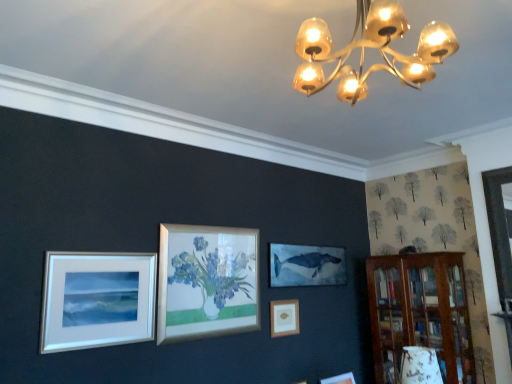
You are a GUI agent. You are given a task and a screenshot of the screen. Output one action in this format:
    pyautogui.click(x=<x>, y=<y>)
    Task: Click on the wooden frame at center, the 1th picture frame when ordered from right to left
    
    Given the screenshot: What is the action you would take?
    pyautogui.click(x=284, y=318)

Identify the location of wooden bookshelf at right. This screenshot has width=512, height=384. (420, 313).

The image size is (512, 384). Identify the location of wooden frame at center, the 2th picture frame viewed from the front. (284, 318).

Between metallic gold chandelier at upper center and wooden frame at center, the 2th picture frame viewed from the left, which one has larger size?

metallic gold chandelier at upper center is bigger.

Based on the photo, which object is wider, metallic gold chandelier at upper center or wooden frame at center, the 1th picture frame from the bottom?

Wider between the two is metallic gold chandelier at upper center.

From the image's perspective, is metallic gold chandelier at upper center on top of wooden frame at center, the 1th picture frame from the bottom?

Yes.

Is metallic gold chandelier at upper center aimed at wooden frame at center, the 1th picture frame when ordered from right to left?

No, metallic gold chandelier at upper center does not turn towards wooden frame at center, the 1th picture frame when ordered from right to left.

Is point (147, 272) closer or farther from the camera than point (361, 51)?

Point (147, 272) appears to be farther away from the viewer than point (361, 51).

Identify the location of lamp on the right of white matte picture frame at lower left, which is the 2th picture frame from back to front. (370, 47).

Would you say white matte picture frame at lower left, which ranks as the 1th picture frame in front-to-back order, contains metallic gold chandelier at upper center?

That's incorrect, metallic gold chandelier at upper center is not inside white matte picture frame at lower left, which ranks as the 1th picture frame in front-to-back order.

Is there a large distance between white matte picture frame at lower left, the first picture frame from the left, and metallic gold chandelier at upper center?

Yes, white matte picture frame at lower left, the first picture frame from the left, and metallic gold chandelier at upper center are quite far apart.

Considering the relative sizes of metallic gold chandelier at upper center and wooden bookshelf at right in the image provided, is metallic gold chandelier at upper center shorter than wooden bookshelf at right?

Yes.

Considering the positions of objects metallic gold chandelier at upper center and wooden bookshelf at right in the image provided, who is more to the right, metallic gold chandelier at upper center or wooden bookshelf at right?

Positioned to the right is wooden bookshelf at right.

From the picture: From the image's perspective, who appears lower, metallic gold chandelier at upper center or wooden bookshelf at right?

wooden bookshelf at right is shown below in the image.

In the scene shown: Is metallic gold chandelier at upper center bigger than wooden bookshelf at right?

No, metallic gold chandelier at upper center is not bigger than wooden bookshelf at right.

Where is `picture frame that appears in front of the wooden frame at center, the 1th picture frame when ordered from right to left`? Image resolution: width=512 pixels, height=384 pixels. picture frame that appears in front of the wooden frame at center, the 1th picture frame when ordered from right to left is located at coordinates (97, 300).

From the image's perspective, which one is positioned higher, wooden frame at center, the 1th picture frame from the bottom, or white matte picture frame at lower left, the first picture frame from the left?

white matte picture frame at lower left, the first picture frame from the left, is shown above in the image.

Based on the photo, between wooden frame at center, the 1th picture frame from the bottom, and white matte picture frame at lower left, which is the 2th picture frame from back to front, which one has less height?

Standing shorter between the two is wooden frame at center, the 1th picture frame from the bottom.

Considering the sizes of wooden bookshelf at right and metallic gold chandelier at upper center in the image, is wooden bookshelf at right taller or shorter than metallic gold chandelier at upper center?

Clearly, wooden bookshelf at right is taller compared to metallic gold chandelier at upper center.

From the picture: Do you think wooden bookshelf at right is within metallic gold chandelier at upper center, or outside of it?

wooden bookshelf at right exists outside the volume of metallic gold chandelier at upper center.

From a real-world perspective, between wooden bookshelf at right and metallic gold chandelier at upper center, who is vertically lower?

From a 3D spatial view, wooden bookshelf at right is below.

Which is correct: wooden bookshelf at right is inside wooden frame at center, the 2th picture frame viewed from the front, or outside of it?

wooden bookshelf at right is spatially situated outside wooden frame at center, the 2th picture frame viewed from the front.

Is wooden bookshelf at right looking in the opposite direction of wooden frame at center, the 2th picture frame viewed from the left?

That's not correct — wooden bookshelf at right is not looking away from wooden frame at center, the 2th picture frame viewed from the left.

Does point (369, 299) come farther from viewer compared to point (296, 328)?

Yes.

Identify the location of bookshelf in front of the wooden frame at center, the 2th picture frame viewed from the left. (420, 313).

Would you consider metallic gold chandelier at upper center to be distant from white matte picture frame at lower left, which is the 1th picture frame from top to bottom?

Indeed, metallic gold chandelier at upper center is not near white matte picture frame at lower left, which is the 1th picture frame from top to bottom.

Between metallic gold chandelier at upper center and white matte picture frame at lower left, which is the second picture frame from bottom to top, which one has smaller size?

white matte picture frame at lower left, which is the second picture frame from bottom to top, is smaller.

In terms of height, does metallic gold chandelier at upper center look taller or shorter compared to white matte picture frame at lower left, which is the 2th picture frame from back to front?

In the image, metallic gold chandelier at upper center appears to be shorter than white matte picture frame at lower left, which is the 2th picture frame from back to front.

This screenshot has width=512, height=384. In order to click on lamp lying above the wooden frame at center, the first picture frame viewed from the back (from the image's perspective) in this screenshot , I will do `click(370, 47)`.

From the image's perspective, which picture frame is the 1st one below the metallic gold chandelier at upper center? Please provide its 2D coordinates.

[(97, 300)]

From the image, which object appears to be farther from white matte picture frame at lower left, the first picture frame from the left, wooden bookshelf at right or wooden frame at center, which appears as the second picture frame when viewed from the top?

The object further to white matte picture frame at lower left, the first picture frame from the left, is wooden bookshelf at right.

Based on their spatial positions, is wooden bookshelf at right or white matte picture frame at lower left, which is the second picture frame from bottom to top, further from metallic gold chandelier at upper center?

wooden bookshelf at right is further to metallic gold chandelier at upper center.

When comparing their distances from white matte picture frame at lower left, the 2th picture frame from the right, does metallic gold chandelier at upper center or wooden frame at center, the 2th picture frame viewed from the front, seem closer?

Based on the image, wooden frame at center, the 2th picture frame viewed from the front, appears to be nearer to white matte picture frame at lower left, the 2th picture frame from the right.

Estimate the real-world distances between objects in this image. Which object is further from metallic gold chandelier at upper center, wooden bookshelf at right or wooden frame at center, the 1th picture frame when ordered from right to left?

The object further to metallic gold chandelier at upper center is wooden bookshelf at right.

Looking at the image, which one is located further to metallic gold chandelier at upper center, wooden frame at center, the 1th picture frame from the bottom, or white matte picture frame at lower left, which is the second picture frame from bottom to top?

wooden frame at center, the 1th picture frame from the bottom.

When comparing their distances from wooden bookshelf at right, does white matte picture frame at lower left, which ranks as the 1th picture frame in front-to-back order, or wooden frame at center, the 1th picture frame from the bottom, seem further?

white matte picture frame at lower left, which ranks as the 1th picture frame in front-to-back order.

From the picture: Considering their positions, is wooden frame at center, the 2th picture frame viewed from the front, positioned closer to white matte picture frame at lower left, the first picture frame from the left, than wooden bookshelf at right?

The object closer to white matte picture frame at lower left, the first picture frame from the left, is wooden frame at center, the 2th picture frame viewed from the front.

When comparing their distances from white matte picture frame at lower left, which ranks as the 1th picture frame in front-to-back order, does wooden bookshelf at right or metallic gold chandelier at upper center seem further?

wooden bookshelf at right is positioned further to the anchor white matte picture frame at lower left, which ranks as the 1th picture frame in front-to-back order.

I want to click on picture frame positioned between metallic gold chandelier at upper center and wooden bookshelf at right from near to far, so click(97, 300).

At what (x,y) coordinates should I click in order to perform the action: click on bookshelf between metallic gold chandelier at upper center and wooden frame at center, the 1th picture frame when ordered from right to left, from front to back. Please return your answer as a coordinate pair (x, y). Looking at the image, I should click on (420, 313).

Where is `picture frame positioned between metallic gold chandelier at upper center and wooden frame at center, the 2th picture frame viewed from the left, from near to far`? The width and height of the screenshot is (512, 384). picture frame positioned between metallic gold chandelier at upper center and wooden frame at center, the 2th picture frame viewed from the left, from near to far is located at coordinates (97, 300).

Find the location of a particular element. This screenshot has width=512, height=384. picture frame between white matte picture frame at lower left, the 2th picture frame from the right, and wooden bookshelf at right from left to right is located at coordinates (284, 318).